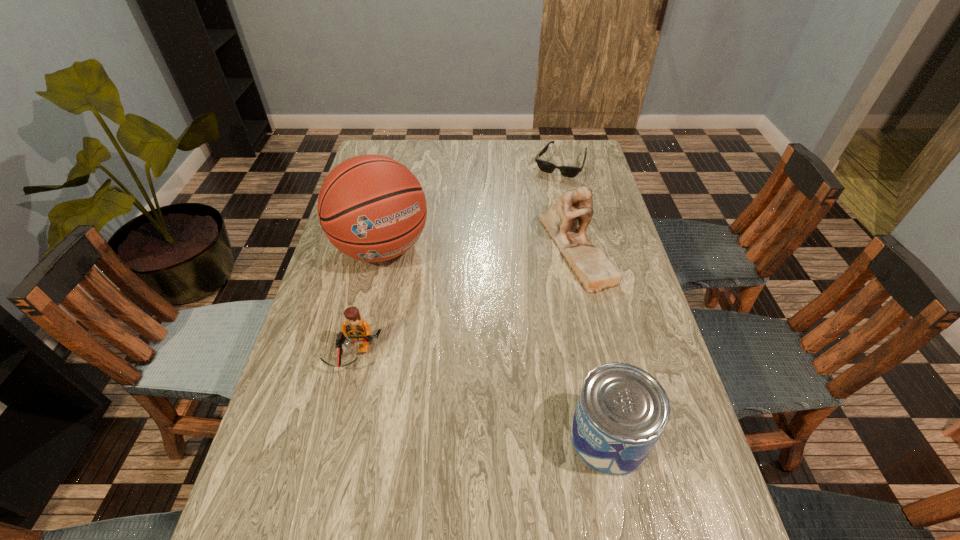
The image size is (960, 540). What are the coordinates of `Lego` in the screenshot? It's located at (358, 331).

Locate an element on the screen. This screenshot has width=960, height=540. the second nearest object is located at coordinates (358, 331).

At what (x,y) coordinates should I click in order to perform the action: click on can. Please return your answer as a coordinate pair (x, y). Looking at the image, I should click on (622, 410).

What are the coordinates of `the third tallest object` in the screenshot? It's located at (622, 410).

Find the location of a particular element. the second tallest object is located at coordinates (591, 266).

At what (x,y) coordinates should I click in order to perform the action: click on the farthest object. Please return your answer as a coordinate pair (x, y). The width and height of the screenshot is (960, 540). Looking at the image, I should click on [568, 171].

At what (x,y) coordinates should I click in order to perform the action: click on the shortest object. Please return your answer as a coordinate pair (x, y). Looking at the image, I should click on (568, 171).

Identify the location of the tallest object. This screenshot has height=540, width=960. (372, 208).

Locate an element on the screen. Image resolution: width=960 pixels, height=540 pixels. vacant space situated holding a crossbow in the hands of the fourth tallest object is located at coordinates pyautogui.click(x=331, y=456).

Image resolution: width=960 pixels, height=540 pixels. I want to click on vacant space situated on the front label of the nearest object, so [459, 437].